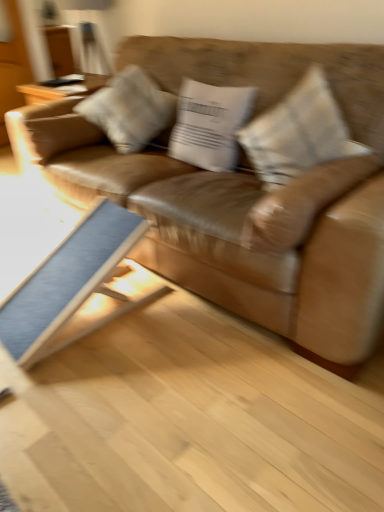
Question: From the image's perspective, is textured beige pillow at center, acting as the 1th pillow starting from the right, positioned above or below white cotton pillow at center, arranged as the second pillow when viewed from the right?

Choices:
 (A) above
 (B) below

Answer: (B)

Question: Is textured beige pillow at center, acting as the 1th pillow starting from the right, wider or thinner than white cotton pillow at center, arranged as the second pillow when viewed from the right?

Choices:
 (A) wide
 (B) thin

Answer: (A)

Question: Which object is the closest to the brown leather couch at center?

Choices:
 (A) light gray fabric pillow at center, the first pillow in the left-to-right sequence
 (B) white cotton pillow at center, the 2th pillow positioned from the left
 (C) blue fabric table at lower left
 (D) textured beige pillow at center, acting as the 1th pillow starting from the right

Answer: (D)

Question: Which is nearer to the blue fabric table at lower left?

Choices:
 (A) brown leather couch at center
 (B) textured beige pillow at center, acting as the 1th pillow starting from the right
 (C) white cotton pillow at center, the 2th pillow positioned from the left
 (D) light gray fabric pillow at center, the first pillow in the left-to-right sequence

Answer: (A)